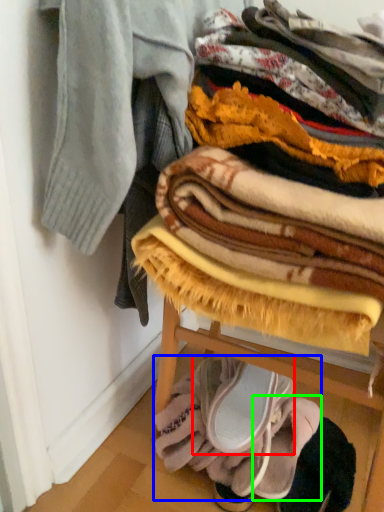
Question: Which object is positioned closest to footwear (highlighted by a red box)? Select from blanket (highlighted by a blue box) and footwear (highlighted by a green box).

Choices:
 (A) blanket
 (B) footwear

Answer: (A)